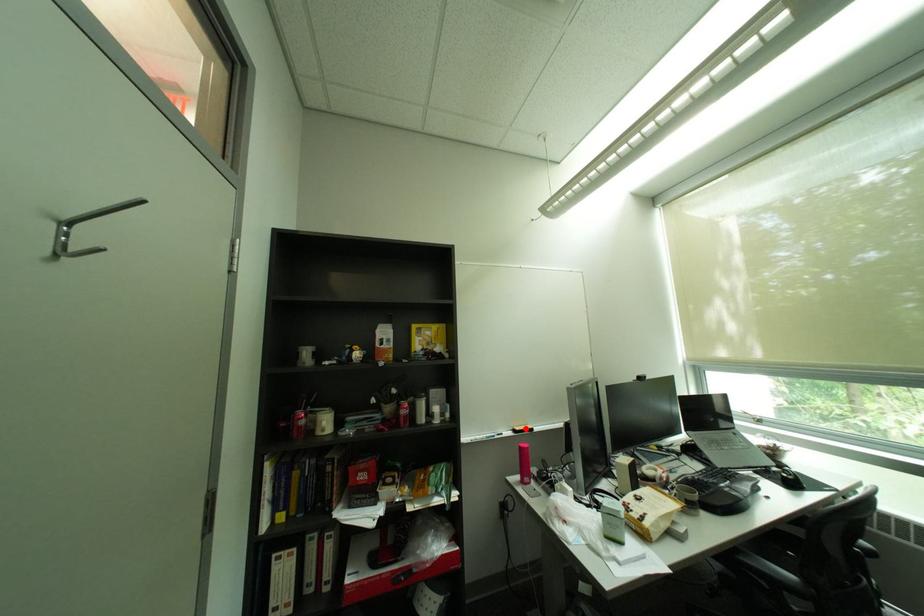
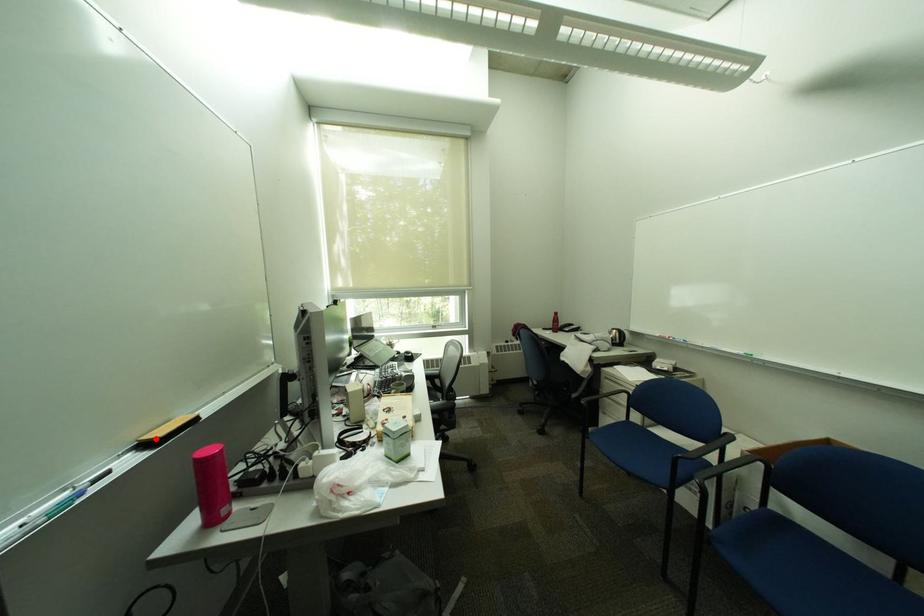
I am providing you with two images of the same scene from different viewpoints. A red point is marked on the first image and another point is marked on the second image. Is the red point in image1 aligned with the point shown in image2?

Yes